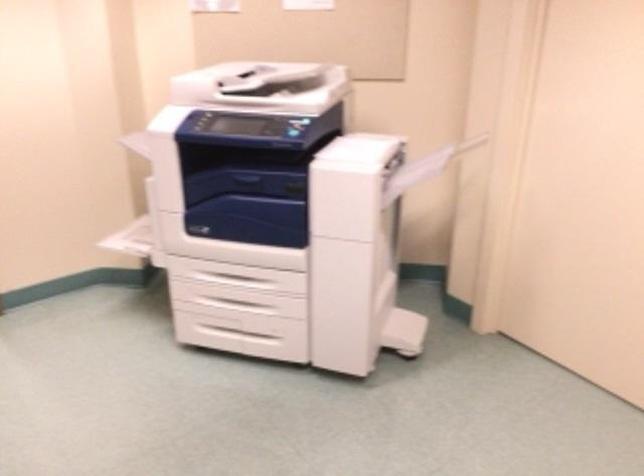
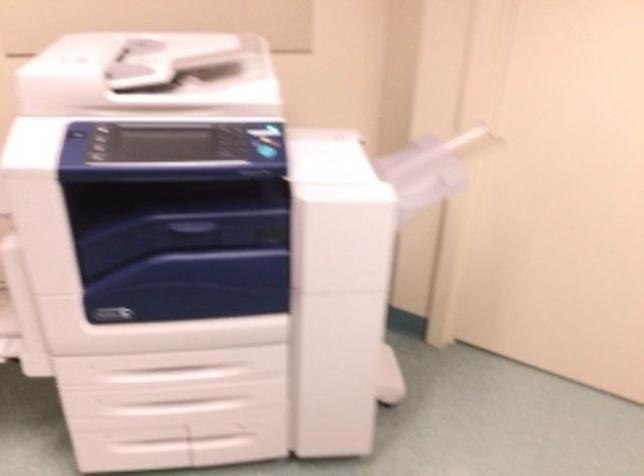
Locate, in the second image, the point that corresponds to point (272, 132) in the first image.

(232, 150)